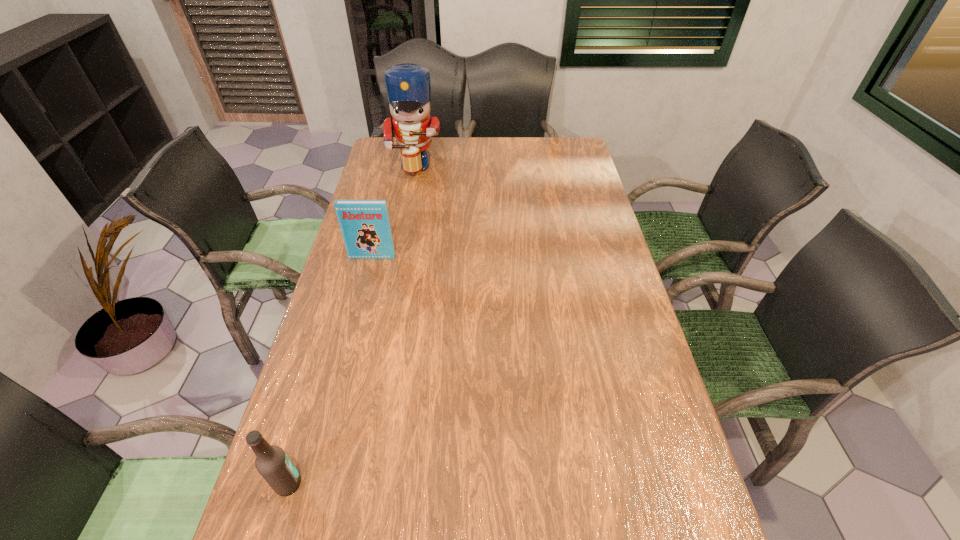
Identify the location of nutcracker. (408, 86).

I want to click on the tallest object, so click(408, 86).

Where is `the second nearest object`? The width and height of the screenshot is (960, 540). the second nearest object is located at coordinates pos(365,225).

At what (x,y) coordinates should I click in order to perform the action: click on the nearest object. Please return your answer as a coordinate pair (x, y). This screenshot has height=540, width=960. Looking at the image, I should click on (272, 463).

At what (x,y) coordinates should I click in order to perform the action: click on vacant space situated on the front-facing side of the nutcracker. Please return your answer as a coordinate pair (x, y). The image size is (960, 540). Looking at the image, I should click on coord(394,238).

At what (x,y) coordinates should I click in order to perform the action: click on free location located on the front cover of the second farthest object. Please return your answer as a coordinate pair (x, y). Image resolution: width=960 pixels, height=540 pixels. Looking at the image, I should click on (x=366, y=284).

Find the location of a particular element. The image size is (960, 540). free spot located 0.060m on the label of the beer bottle is located at coordinates (330, 484).

Image resolution: width=960 pixels, height=540 pixels. I want to click on object situated at the far edge, so point(408,86).

The height and width of the screenshot is (540, 960). I want to click on nutcracker present at the left edge, so click(408, 86).

The width and height of the screenshot is (960, 540). I want to click on book that is at the left edge, so click(365, 225).